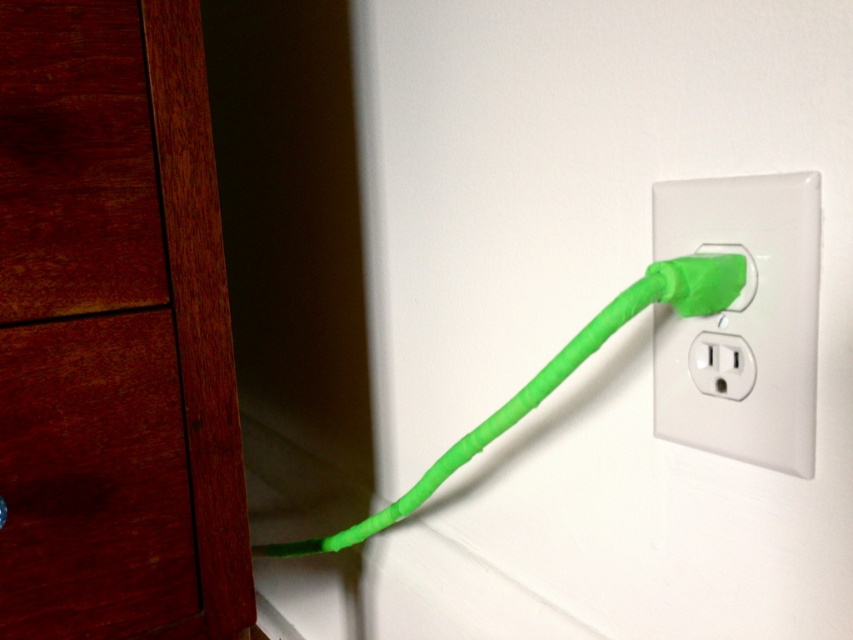
The image size is (853, 640). I want to click on mahogany wood dresser at left, so click(x=114, y=332).

Is point (169, 500) farther from camera compared to point (756, 298)?

Yes, it is behind point (756, 298).

Between point (218, 452) and point (811, 321), which one is positioned behind?

Point (218, 452)

Where is `mahogany wood dresser at left`? mahogany wood dresser at left is located at coordinates (114, 332).

Does mahogany wood drawer at left have a larger size compared to green rubber plug at right?

Yes.

Is the position of mahogany wood drawer at left more distant than that of green rubber plug at right?

Yes, it is behind green rubber plug at right.

Locate an element on the screen. The image size is (853, 640). mahogany wood drawer at left is located at coordinates (93, 480).

Consider the image. Is mahogany wood dresser at left further to camera compared to mahogany wood drawer at left?

No, mahogany wood dresser at left is in front of mahogany wood drawer at left.

Which of these two, mahogany wood dresser at left or mahogany wood drawer at left, stands shorter?

mahogany wood drawer at left is shorter.

This screenshot has width=853, height=640. I want to click on mahogany wood dresser at left, so click(114, 332).